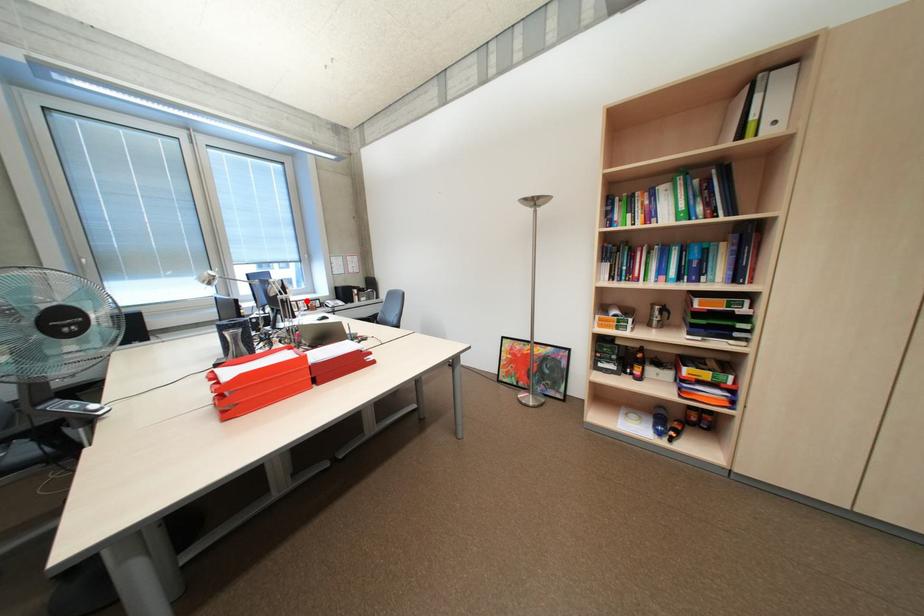
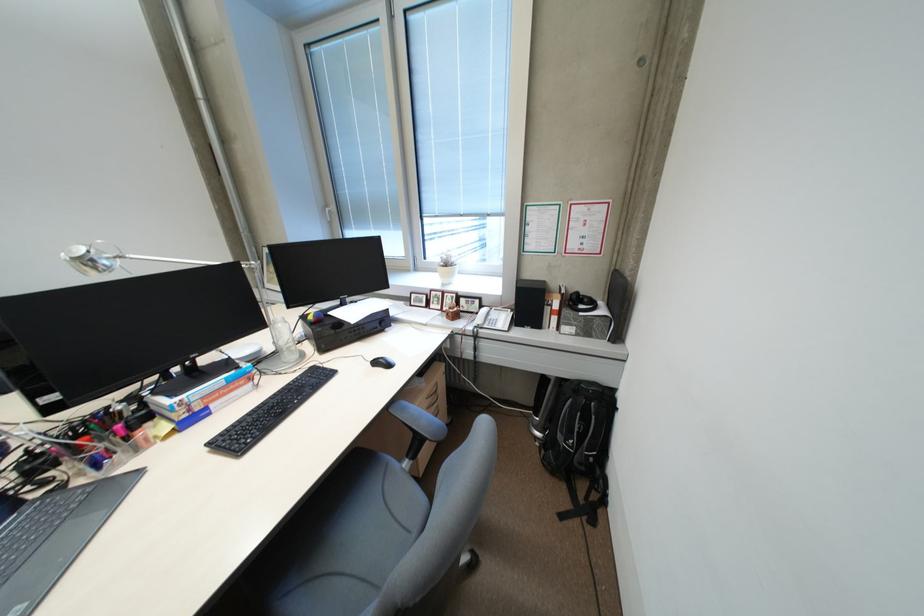
Find the pixel in the second image that matches the highlighted location in the first image.

(454, 292)